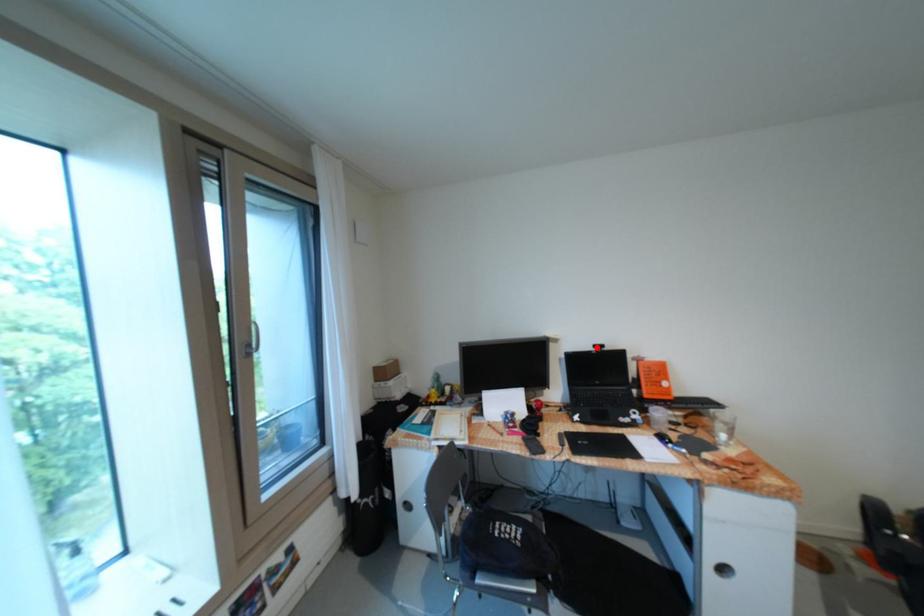
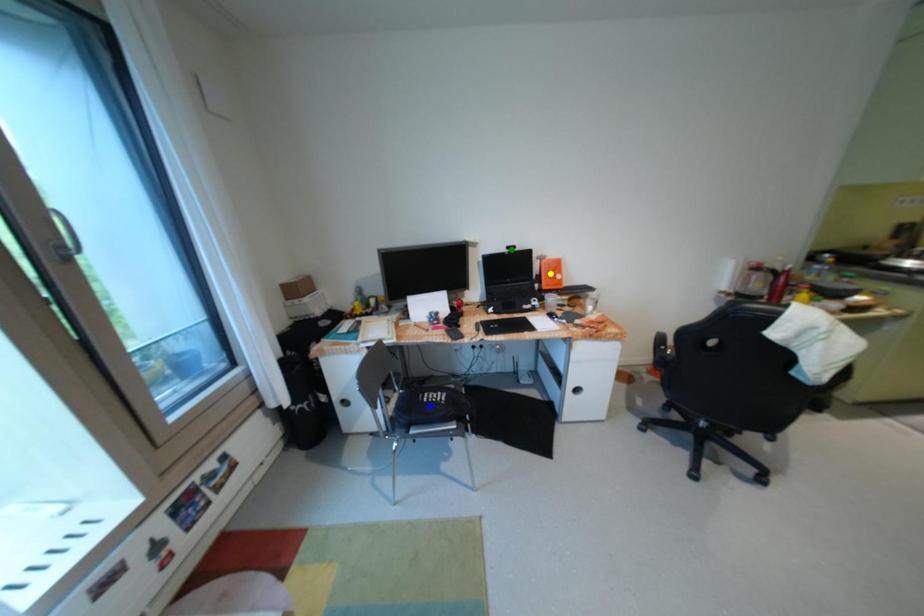
Question: I am providing you with two images of the same scene from different viewpoints. A red point is marked on the first image. You are given multiple points on the second image. Can you choose the point in image 2 that corresponds to the point in image 1?

Choices:
 (A) green point
 (B) yellow point
 (C) blue point

Answer: (A)